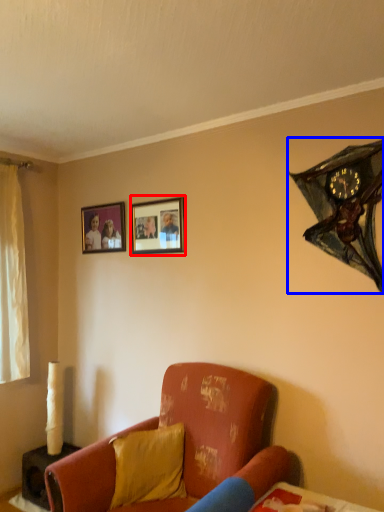
Question: Which object is closer to the camera taking this photo, picture frame (highlighted by a red box) or clock (highlighted by a blue box)?

Choices:
 (A) picture frame
 (B) clock

Answer: (B)